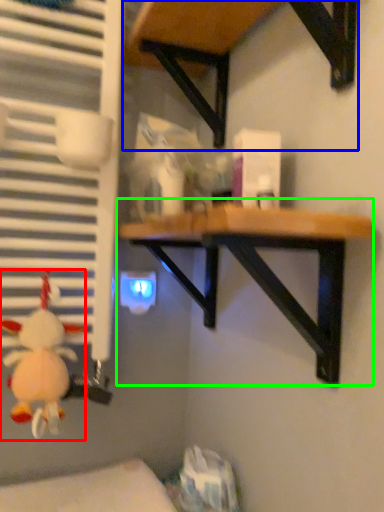
Question: Which object is positioned closest to toy (highlighted by a red box)? Select from table (highlighted by a blue box) and table (highlighted by a green box).

Choices:
 (A) table
 (B) table

Answer: (B)